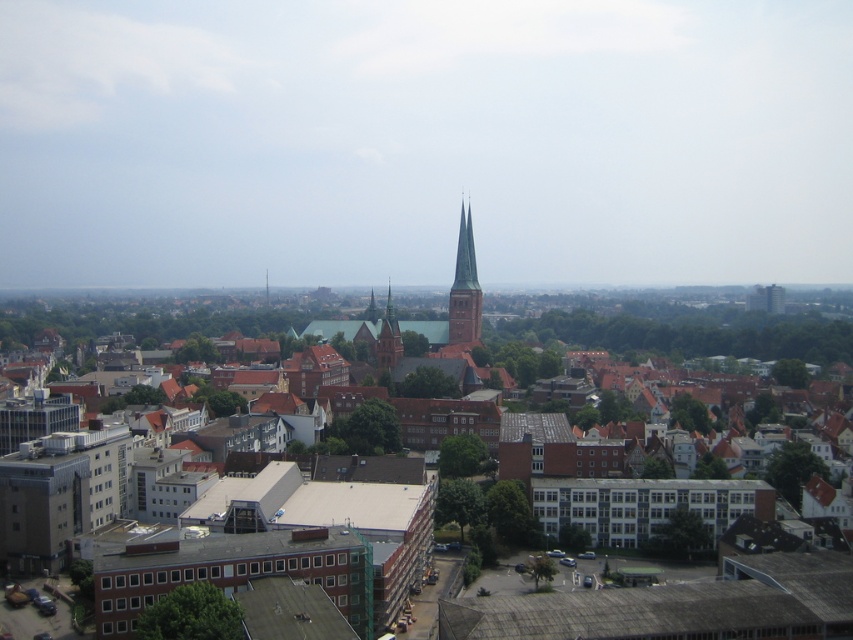
Is point (231, 522) in front of point (463, 244)?

Yes, it is in front of point (463, 244).

Find the location of a particular element. Image resolution: width=853 pixels, height=640 pixels. brown brick town at center is located at coordinates (511, 440).